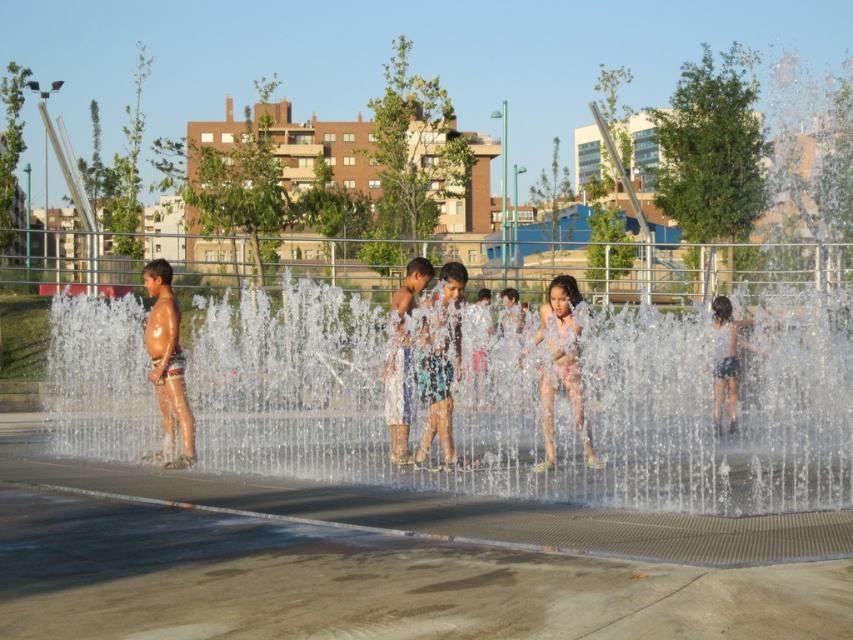
You are a photographer at the water play area. You want to capture a photo of the pink fabric dress at center and the white cotton shorts at center. Which one is positioned higher in the frame?

The pink fabric dress at center is above the white cotton shorts at center, so it is positioned higher in the frame.

You are a photographer standing at the edge of the water play area. You want to take a photo that includes both the shiny metallic shorts at left and dark blue shorts at right. Which pair of shorts should you focus on first to ensure both are in the frame?

The shiny metallic shorts at left is positioned over dark blue shorts at right, so you should focus on the shiny metallic shorts at left first to ensure both are in the frame.

You are a parent at the water play area. You see your child wearing a pink fabric dress at center and another child wearing dark blue shorts at right. Which child is closer to you?

The pink fabric dress at center is closer to you because it is in front of the dark blue shorts at right.